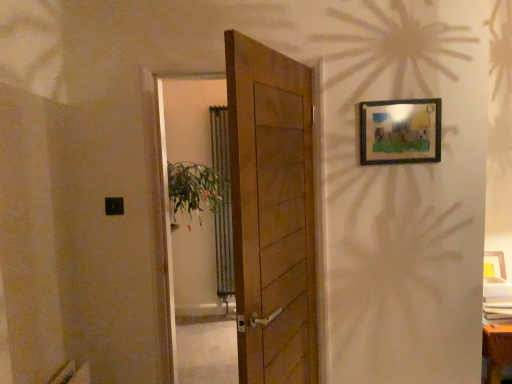
Locate an element on the screen. This screenshot has height=384, width=512. wooden door at center is located at coordinates (272, 213).

What is the approximate width of wooden door at center?

6.24 inches.

The width and height of the screenshot is (512, 384). Identify the location of green leafy plant at center. (194, 190).

How different are the orientations of wooden door at center and wooden picture frame at upper right in degrees?

The facing directions of wooden door at center and wooden picture frame at upper right are 66.8 degrees apart.

Does wooden door at center appear on the right side of wooden picture frame at upper right?

Incorrect, wooden door at center is not on the right side of wooden picture frame at upper right.

Where is `picture frame above the wooden door at center (from a real-world perspective)`? picture frame above the wooden door at center (from a real-world perspective) is located at coordinates pos(400,131).

Between wooden door at center and wooden picture frame at upper right, which one has less height?

With less height is wooden picture frame at upper right.

Is wooden door at center spatially inside green leafy plant at center, or outside of it?

wooden door at center is outside green leafy plant at center.

From their relative heights in the image, would you say wooden door at center is taller or shorter than green leafy plant at center?

Considering their sizes, wooden door at center has more height than green leafy plant at center.

Which object is wider, wooden door at center or green leafy plant at center?

With larger width is green leafy plant at center.

In the image, is wooden door at center on the left side or the right side of green leafy plant at center?

Clearly, wooden door at center is on the right of green leafy plant at center in the image.

In terms of width, does wooden door at center look wider or thinner when compared to wooden door at center?

wooden door at center is wider than wooden door at center.

From a real-world perspective, is wooden door at center under wooden door at center?

Actually, wooden door at center is physically above wooden door at center in the real world.

Choose the correct answer: Is wooden door at center inside wooden door at center or outside it?

Result: wooden door at center cannot be found inside wooden door at center.

Is wooden door at center wider than green leafy plant at center?

In fact, wooden door at center might be narrower than green leafy plant at center.

Can you see wooden door at center touching green leafy plant at center?

No.

From the image's perspective, which one is positioned higher, wooden door at center or green leafy plant at center?

green leafy plant at center.

Who is bigger, wooden door at center or green leafy plant at center?

With larger size is wooden door at center.

Considering the positions of point (407, 161) and point (192, 164), is point (407, 161) closer or farther from the camera than point (192, 164)?

Clearly, point (407, 161) is closer to the camera than point (192, 164).

Which of these two, wooden picture frame at upper right or green leafy plant at center, stands taller?

wooden picture frame at upper right.

Where is `picture frame in front of the green leafy plant at center`? picture frame in front of the green leafy plant at center is located at coordinates (400, 131).

Is wooden picture frame at upper right positioned with its back to green leafy plant at center?

No, wooden picture frame at upper right is not facing away from green leafy plant at center.

Who is taller, green leafy plant at center or wooden door at center?

Standing taller between the two is wooden door at center.

Relative to wooden door at center, is green leafy plant at center in front or behind?

green leafy plant at center is positioned farther from the viewer than wooden door at center.

From the image's perspective, which object appears higher, green leafy plant at center or wooden door at center?

green leafy plant at center is shown above in the image.

Is green leafy plant at center bigger or smaller than wooden door at center?

Clearly, green leafy plant at center is smaller in size than wooden door at center.

How many degrees apart are the facing directions of green leafy plant at center and wooden door at center?

0.00433 degrees separate the facing orientations of green leafy plant at center and wooden door at center.

Considering the positions of point (185, 205) and point (166, 240), is point (185, 205) closer or farther from the camera than point (166, 240)?

Clearly, point (185, 205) is more distant from the camera than point (166, 240).

In terms of size, does green leafy plant at center appear bigger or smaller than wooden door at center?

Clearly, green leafy plant at center is smaller in size than wooden door at center.

Image resolution: width=512 pixels, height=384 pixels. What are the coordinates of `door in front of the wooden picture frame at upper right` in the screenshot? It's located at [272, 213].

Find the location of `screen door on the right side of green leafy plant at center`. screen door on the right side of green leafy plant at center is located at coordinates (186, 117).

When comparing their distances from wooden door at center, does green leafy plant at center or wooden picture frame at upper right seem further?

wooden picture frame at upper right is further to wooden door at center.

Estimate the real-world distances between objects in this image. Which object is further from wooden door at center, wooden picture frame at upper right or green leafy plant at center?

wooden picture frame at upper right is positioned further to the anchor wooden door at center.

Which object lies further to the anchor point wooden picture frame at upper right, green leafy plant at center or wooden door at center?

Among the two, green leafy plant at center is located further to wooden picture frame at upper right.

When comparing their distances from wooden picture frame at upper right, does wooden door at center or green leafy plant at center seem closer?

green leafy plant at center lies closer to wooden picture frame at upper right than the other object.

Which object lies nearer to the anchor point green leafy plant at center, wooden door at center or wooden door at center?

Based on the image, wooden door at center appears to be nearer to green leafy plant at center.

From the image, which object appears to be farther from wooden door at center, green leafy plant at center or wooden door at center?

wooden door at center is further to wooden door at center.

Based on their spatial positions, is wooden picture frame at upper right or wooden door at center closer to wooden door at center?

wooden picture frame at upper right.

Based on their spatial positions, is wooden picture frame at upper right or green leafy plant at center further from wooden door at center?

green leafy plant at center lies further to wooden door at center than the other object.

The image size is (512, 384). What are the coordinates of `screen door between green leafy plant at center and wooden picture frame at upper right` in the screenshot? It's located at (186, 117).

This screenshot has width=512, height=384. In order to click on picture frame between wooden door at center and wooden door at center along the z-axis in this screenshot , I will do `click(400, 131)`.

Where is `door located between green leafy plant at center and wooden picture frame at upper right in the left-right direction`? Image resolution: width=512 pixels, height=384 pixels. door located between green leafy plant at center and wooden picture frame at upper right in the left-right direction is located at coordinates (272, 213).

Locate an element on the screen. This screenshot has width=512, height=384. screen door between wooden door at center and green leafy plant at center in the front-back direction is located at coordinates (186, 117).